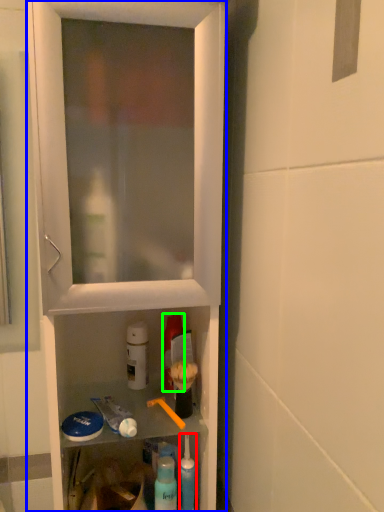
Question: Based on their relative distances, which object is farther from toiletry (highlighted by a red box)? Choose from cabinetry (highlighted by a blue box) and mouthwash (highlighted by a green box).

Choices:
 (A) cabinetry
 (B) mouthwash

Answer: (A)